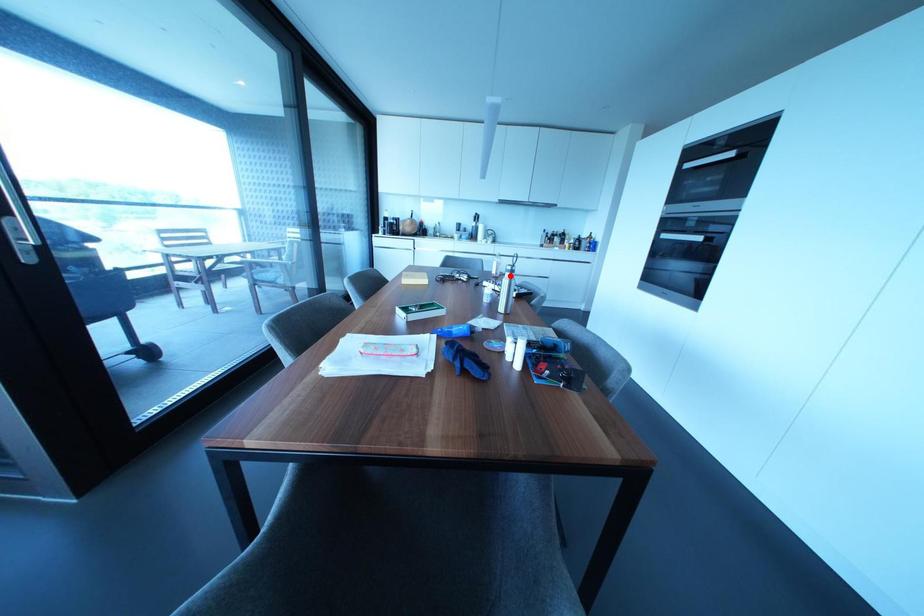
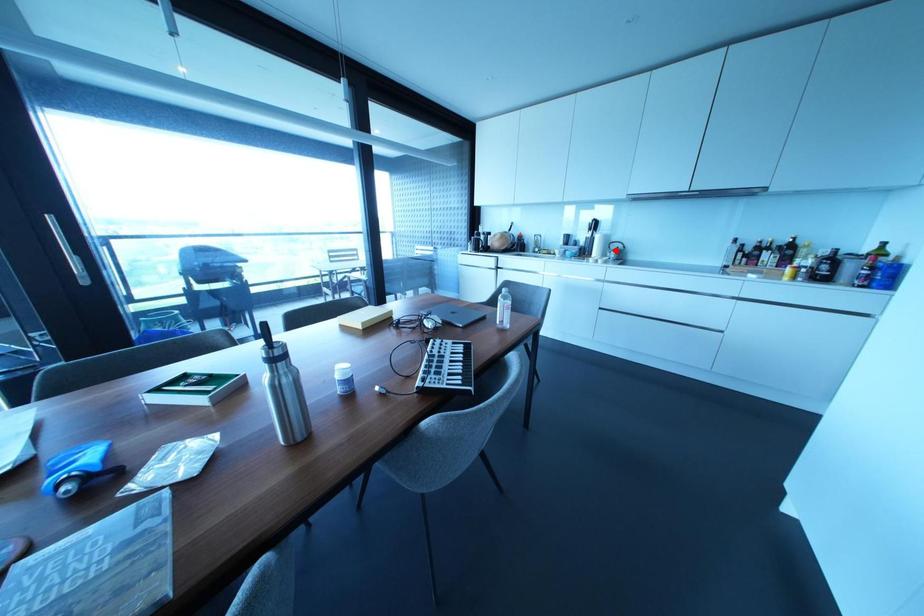
I am providing you with two images of the same scene from different viewpoints. A red point is marked on the first image and another point is marked on the second image. Does the point marked in image1 correspond to the same location as the one in image2?

No